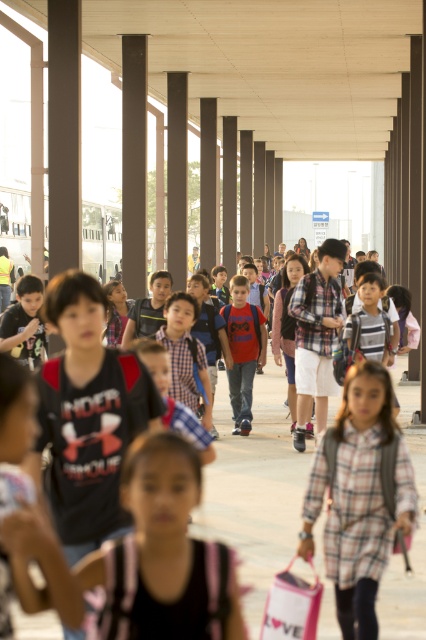
You are a photographer trying to capture a photo of the matte red shirt at center and the matte black backpack at center. If you want to ensure both are fully visible in the frame, which object should you adjust your focus on to account for their sizes?

The matte red shirt at center is wider than the matte black backpack at center, so you should focus on the matte red shirt at center to ensure its entire width fits within the frame.